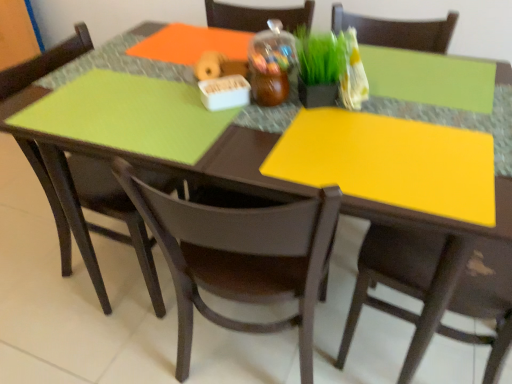
Question: Based on their positions, is green matte grass at center located to the left or right of matte black chair at right, acting as the 3th chair starting from the left?

Choices:
 (A) left
 (B) right

Answer: (A)

Question: Is point (311, 38) positioned closer to the camera than point (407, 273)?

Choices:
 (A) farther
 (B) closer

Answer: (B)

Question: Which object is positioned farthest from the green matte grass at center?

Choices:
 (A) matte black chair at lower left, marked as the first chair in a left-to-right arrangement
 (B) matte black chair at right, acting as the 3th chair starting from the left
 (C) matte brown chair at center, placed as the 2th chair when sorted from left to right

Answer: (A)

Question: Estimate the real-world distances between objects in this image. Which object is farther from the matte black chair at right, acting as the 3th chair starting from the left?

Choices:
 (A) matte black chair at lower left, which is counted as the 3th chair, starting from the right
 (B) matte brown chair at center, placed as the 2th chair when sorted from left to right
 (C) green matte grass at center

Answer: (A)